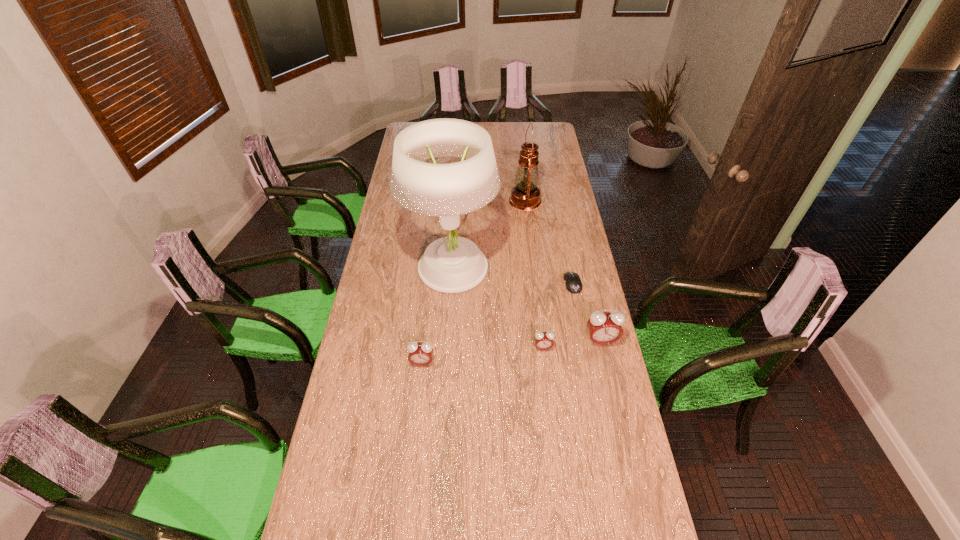
At what (x,y) coordinates should I click in order to perform the action: click on free space for an extra alarm_clock to achieve even spacing. Please return your answer as a coordinate pair (x, y). Looking at the image, I should click on (483, 355).